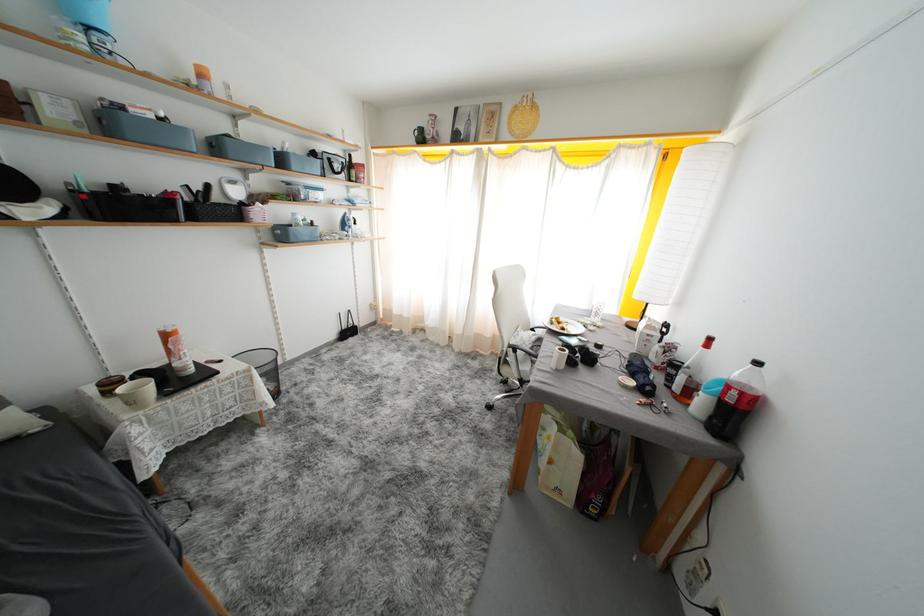
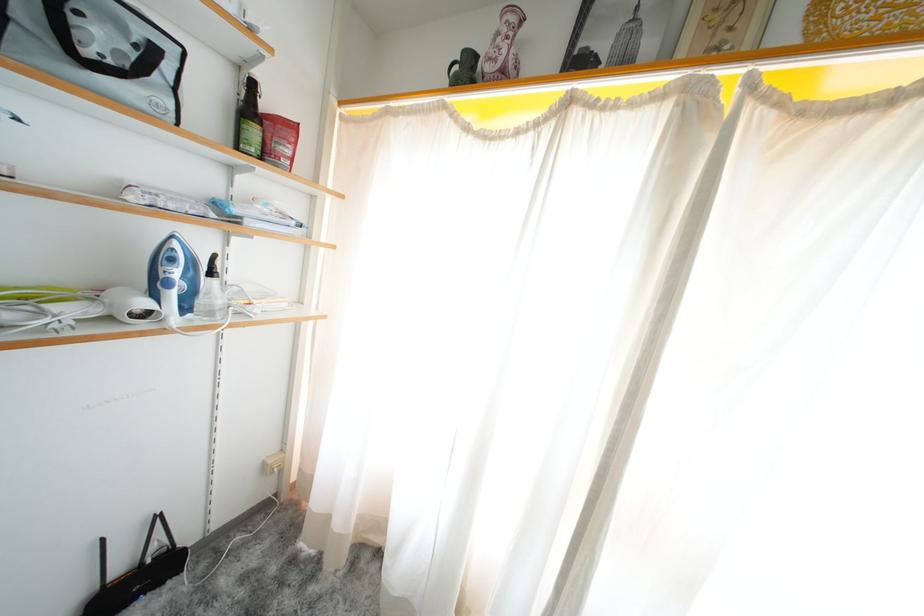
In the second image, find the point that corresponds to point 434,122 in the first image.

(504, 28)